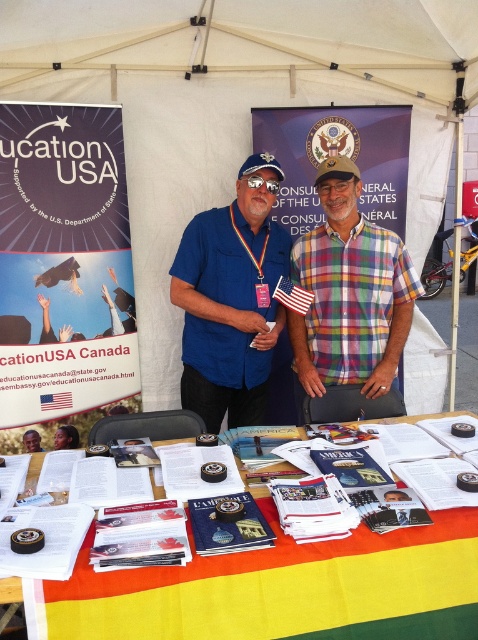
You are a visitor at this event and want to pick up the paper brochures at center. Can you reach them without moving the smooth skin face at center?

The paper brochures at center is above smooth skin face at center, so you can reach them without moving the smooth skin face at center as they are positioned higher.